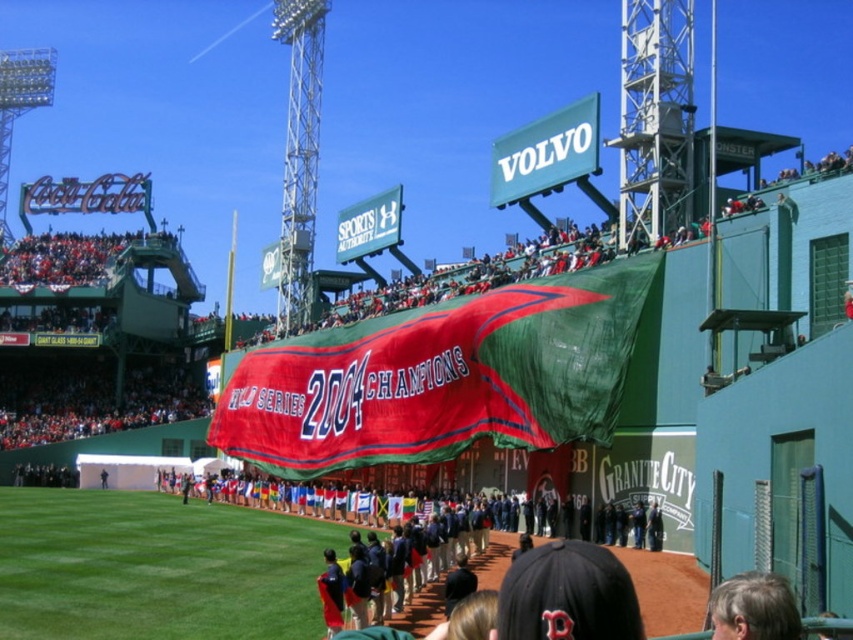
Can you confirm if red fabric banner at center is positioned above gray hair at lower right?

Indeed, red fabric banner at center is positioned over gray hair at lower right.

What do you see at coordinates (440, 378) in the screenshot?
I see `red fabric banner at center` at bounding box center [440, 378].

You are a GUI agent. You are given a task and a screenshot of the screen. Output one action in this format:
    pyautogui.click(x=<x>, y=<y>)
    Task: Click on the red fabric banner at center
    Image resolution: width=853 pixels, height=640 pixels.
    Given the screenshot: What is the action you would take?
    pyautogui.click(x=440, y=378)